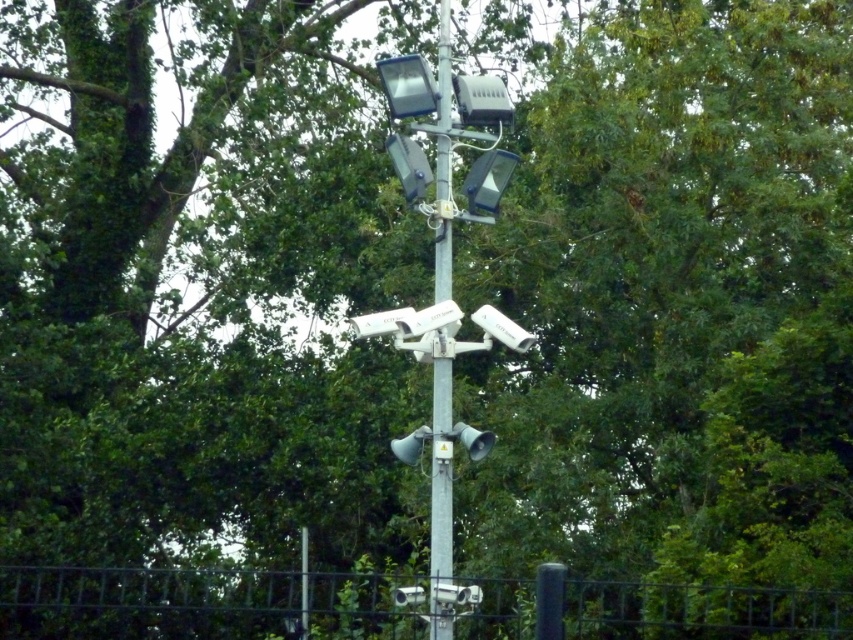
Between metallic wire mesh at lower center and metallic gray pole at center, which one has less height?

metallic gray pole at center

Is point (799, 593) positioned after point (438, 394)?

Yes, point (799, 593) is farther from viewer.

Find the location of a particular element. metallic wire mesh at lower center is located at coordinates (144, 600).